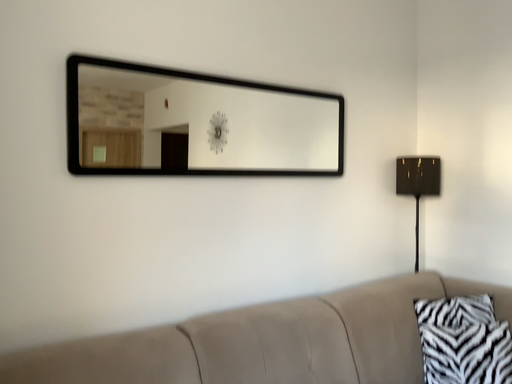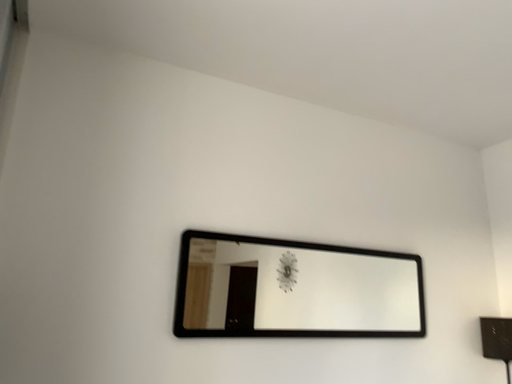
Question: How did the camera likely rotate when shooting the video?

Choices:
 (A) rotated right
 (B) rotated left

Answer: (B)